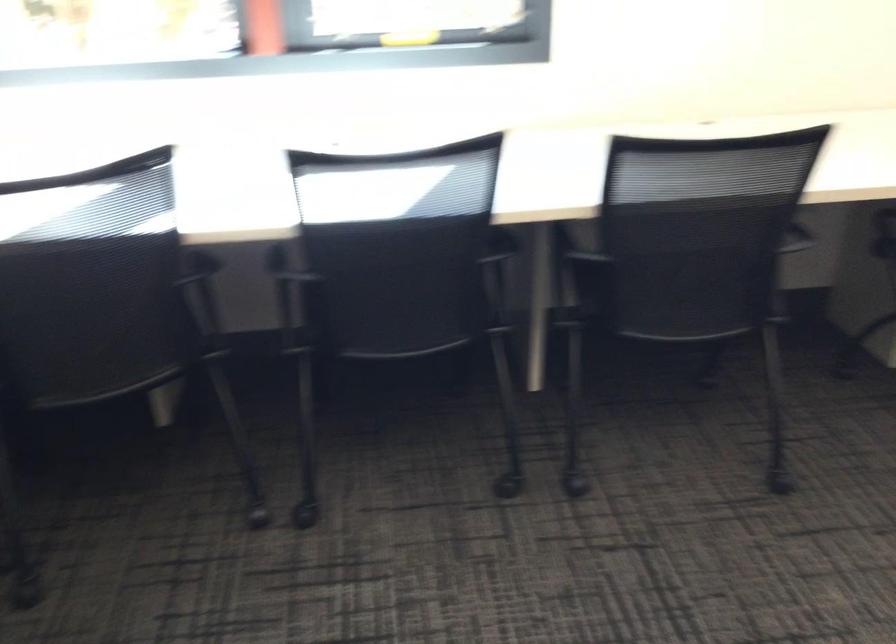
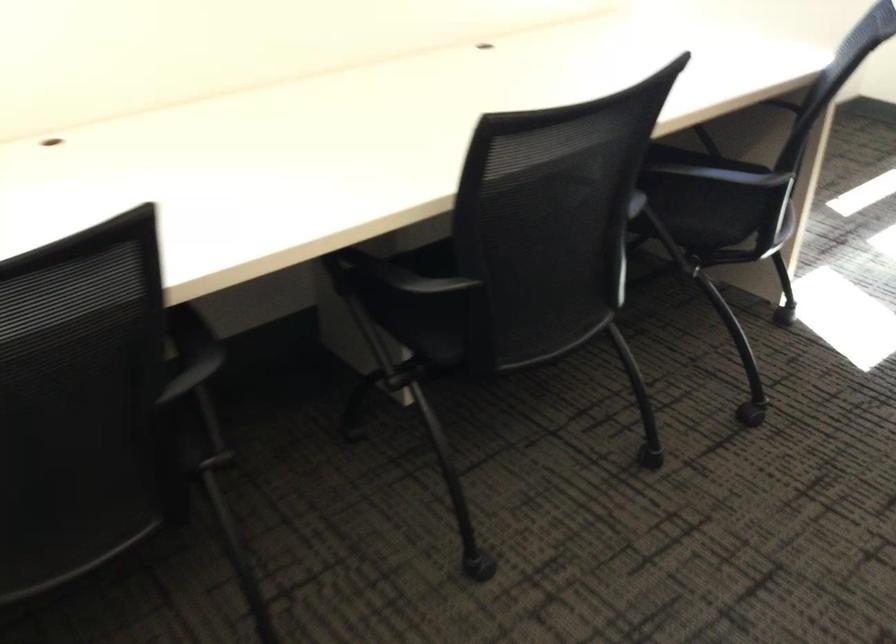
Question: The camera is either moving clockwise (left) or counter-clockwise (right) around the object. The first image is from the beginning of the video and the second image is from the end. Is the camera moving left or right when shooting the video?

Choices:
 (A) Left
 (B) Right

Answer: (A)